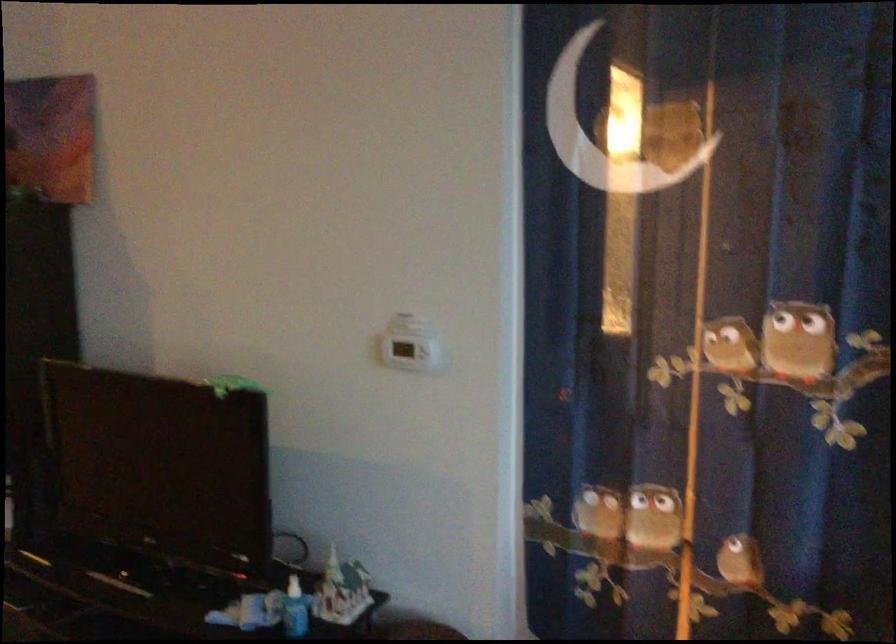
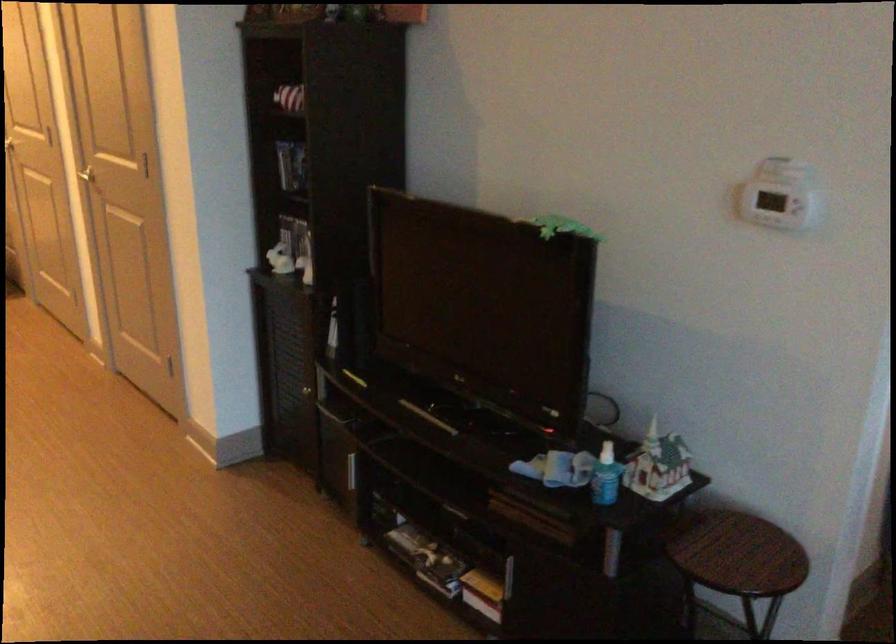
The point at (225, 386) is marked in the first image. Where is the corresponding point in the second image?

(563, 227)